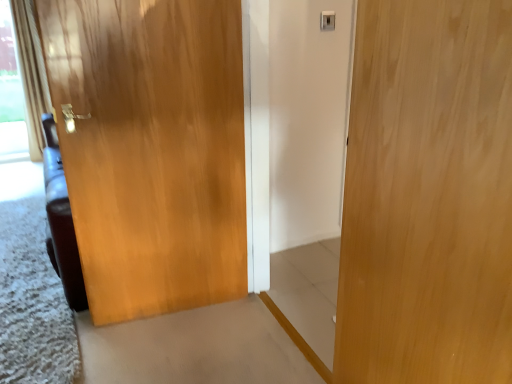
Question: Is glossy wood door at left, the second door from the right, wider than light wood door at center, the 2th door from the left?

Choices:
 (A) yes
 (B) no

Answer: (A)

Question: Can you confirm if glossy wood door at left, which is the first door from back to front, is smaller than light wood door at center, the second door in the back-to-front sequence?

Choices:
 (A) no
 (B) yes

Answer: (A)

Question: Is glossy wood door at left, the 1th door when ordered from left to right, positioned beyond the bounds of light wood door at center, the second door in the back-to-front sequence?

Choices:
 (A) no
 (B) yes

Answer: (B)

Question: Can you confirm if glossy wood door at left, the second door from the right, is thinner than light wood door at center, placed as the 1th door when sorted from right to left?

Choices:
 (A) no
 (B) yes

Answer: (A)

Question: From the image's perspective, is glossy wood door at left, the 1th door when ordered from left to right, under light wood door at center, acting as the first door starting from the front?

Choices:
 (A) yes
 (B) no

Answer: (B)

Question: Does glossy wood door at left, the second door from the right, touch light wood door at center, placed as the 1th door when sorted from right to left?

Choices:
 (A) yes
 (B) no

Answer: (B)

Question: Is beige textured curtain at left placed right next to glossy wood door at left, which is the first door from back to front?

Choices:
 (A) no
 (B) yes

Answer: (A)

Question: Is beige textured curtain at left not near glossy wood door at left, the 1th door when ordered from left to right?

Choices:
 (A) yes
 (B) no

Answer: (A)

Question: From a real-world perspective, is beige textured curtain at left located higher than glossy wood door at left, the second door from the right?

Choices:
 (A) no
 (B) yes

Answer: (B)

Question: Is beige textured curtain at left thinner than glossy wood door at left, which is the first door from back to front?

Choices:
 (A) yes
 (B) no

Answer: (B)

Question: Is beige textured curtain at left positioned in front of glossy wood door at left, which is the first door from back to front?

Choices:
 (A) no
 (B) yes

Answer: (A)

Question: Can we say beige textured curtain at left lies outside glossy wood door at left, arranged as the 2th door when viewed from the front?

Choices:
 (A) no
 (B) yes

Answer: (B)

Question: Is beige textured curtain at left oriented towards light wood door at center, acting as the first door starting from the front?

Choices:
 (A) yes
 (B) no

Answer: (B)